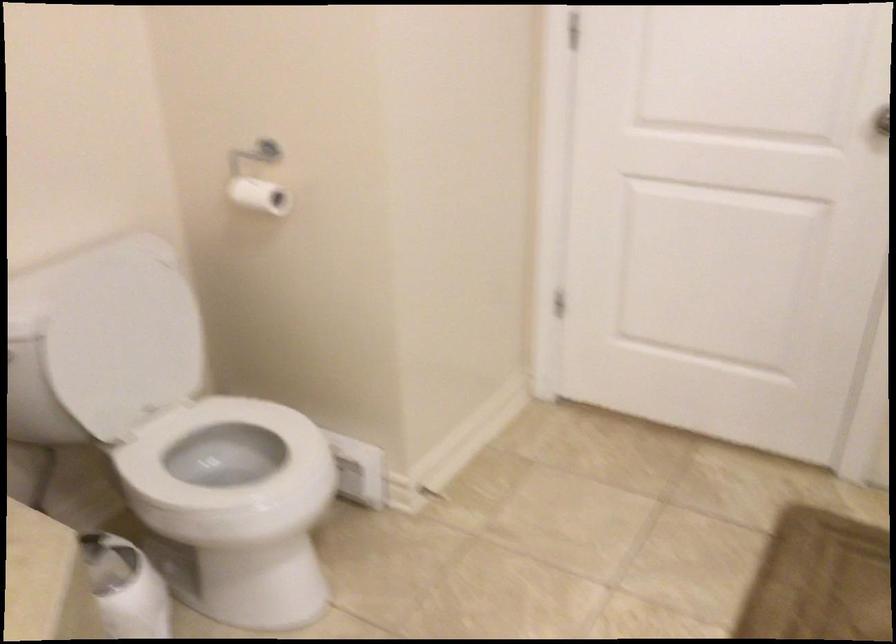
Where would you lift the white toilet lid? Please return your answer as a coordinate pair (x, y).

(122, 346)